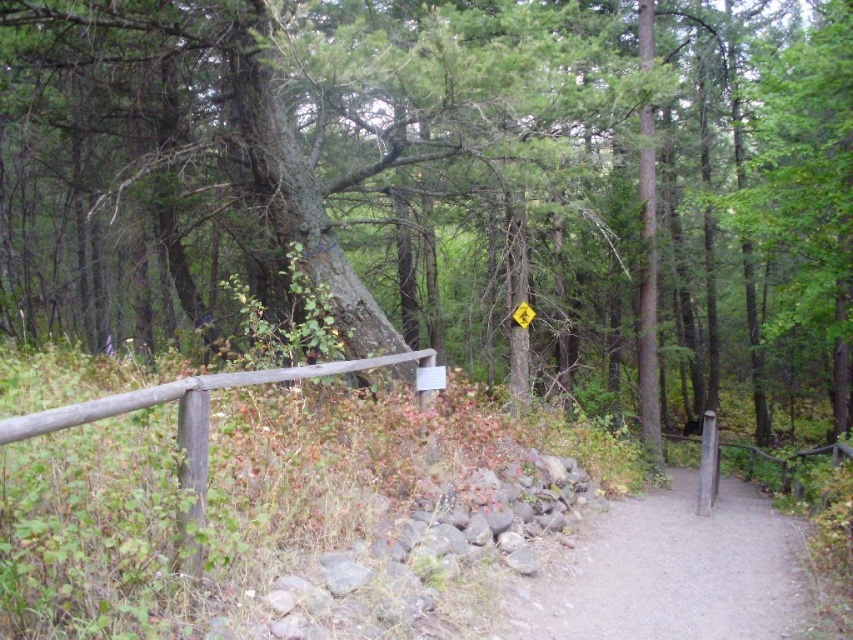
Does green rough bark tree at center appear on the right side of dirt/gravel path at center?

Correct, you'll find green rough bark tree at center to the right of dirt/gravel path at center.

Who is taller, green rough bark tree at center or dirt/gravel path at center?

green rough bark tree at center

Does point (10, 88) come closer to viewer compared to point (614, 612)?

No, (10, 88) is further to viewer.

Locate an element on the screen. The height and width of the screenshot is (640, 853). green rough bark tree at center is located at coordinates (447, 186).

Is green rough bark tree at center to the left of yellow plastic sign at center from the viewer's perspective?

Incorrect, green rough bark tree at center is not on the left side of yellow plastic sign at center.

Is green rough bark tree at center above yellow plastic sign at center?

Correct, green rough bark tree at center is located above yellow plastic sign at center.

Who is more forward, (550, 273) or (515, 308)?

Point (515, 308)

In order to click on green rough bark tree at center in this screenshot , I will do `click(447, 186)`.

Measure the distance between point (804, 605) and camera.

The distance of point (804, 605) from camera is 5.71 meters.

Between point (602, 568) and point (22, 417), which one is positioned in front?

Point (22, 417) is in front.

Is point (595, 570) closer to camera compared to point (293, 372)?

That is False.

I want to click on dirt/gravel path at center, so click(669, 572).